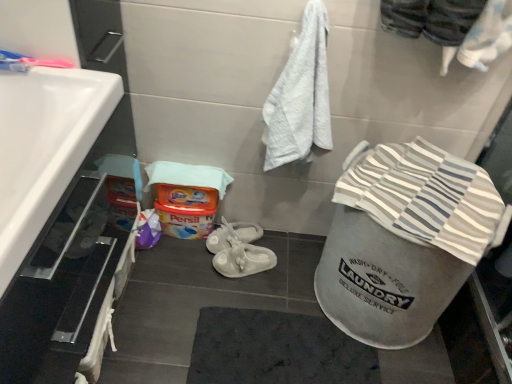
Question: From a real-world perspective, is white glossy sink at left beneath white rubber sandals at center?

Choices:
 (A) no
 (B) yes

Answer: (A)

Question: Does white glossy sink at left have a smaller size compared to white rubber sandals at center?

Choices:
 (A) no
 (B) yes

Answer: (A)

Question: From a real-world perspective, is white glossy sink at left over white rubber sandals at center?

Choices:
 (A) no
 (B) yes

Answer: (B)

Question: Does white glossy sink at left come in front of white rubber sandals at center?

Choices:
 (A) yes
 (B) no

Answer: (A)

Question: Does white glossy sink at left have a lesser height compared to white rubber sandals at center?

Choices:
 (A) yes
 (B) no

Answer: (B)

Question: From a real-world perspective, relative to striped cotton beach towel at lower right, is white rubber sandals at center vertically above or below?

Choices:
 (A) below
 (B) above

Answer: (A)

Question: In the image, is white rubber sandals at center positioned in front of or behind striped cotton beach towel at lower right?

Choices:
 (A) front
 (B) behind

Answer: (B)

Question: Is white rubber sandals at center inside or outside of striped cotton beach towel at lower right?

Choices:
 (A) outside
 (B) inside

Answer: (A)

Question: Based on their positions, is white rubber sandals at center located to the left or right of striped cotton beach towel at lower right?

Choices:
 (A) right
 (B) left

Answer: (B)

Question: In the image, is striped cotton beach towel at lower right on the left side or the right side of white glossy sink at left?

Choices:
 (A) right
 (B) left

Answer: (A)

Question: From a real-world perspective, is striped cotton beach towel at lower right positioned above or below white glossy sink at left?

Choices:
 (A) above
 (B) below

Answer: (B)

Question: Is striped cotton beach towel at lower right wider or thinner than white glossy sink at left?

Choices:
 (A) thin
 (B) wide

Answer: (B)

Question: In terms of height, does striped cotton beach towel at lower right look taller or shorter compared to white glossy sink at left?

Choices:
 (A) tall
 (B) short

Answer: (B)

Question: From a real-world perspective, is striped cotton beach towel at lower right positioned above or below white rubber sandals at center?

Choices:
 (A) below
 (B) above

Answer: (B)

Question: Is point (426, 162) closer or farther from the camera than point (234, 274)?

Choices:
 (A) closer
 (B) farther

Answer: (A)